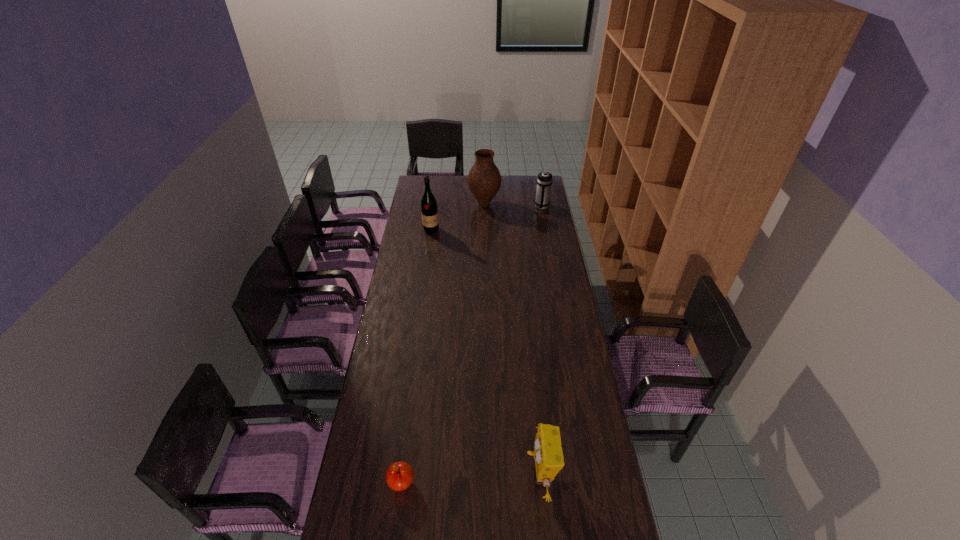
At what (x,y) coordinates should I click in order to perform the action: click on free spot between the sponge and the rightmost object. Please return your answer as a coordinate pair (x, y). This screenshot has height=540, width=960. Looking at the image, I should click on (540, 341).

The image size is (960, 540). I want to click on free space between the thermos bottle and the second object from right to left, so click(540, 341).

Identify the location of vacant area that lies between the third object from right to left and the apple. (443, 343).

Image resolution: width=960 pixels, height=540 pixels. I want to click on vacant area that lies between the shortest object and the sponge, so click(470, 479).

At what (x,y) coordinates should I click in order to perform the action: click on free spot between the thermos bottle and the third nearest object. Please return your answer as a coordinate pair (x, y). Looking at the image, I should click on (487, 218).

The width and height of the screenshot is (960, 540). Identify the location of free space between the shortest object and the vase. (443, 343).

Where is `vacant point located between the sponge and the apple`? The height and width of the screenshot is (540, 960). vacant point located between the sponge and the apple is located at coordinates (470, 479).

Find the location of a particular element. This screenshot has width=960, height=540. free area in between the fourth object from left to right and the vase is located at coordinates (512, 339).

Find the location of `vacant area that lies between the apple and the sponge`. vacant area that lies between the apple and the sponge is located at coordinates (470, 479).

You are a GUI agent. You are given a task and a screenshot of the screen. Output one action in this format:
    pyautogui.click(x=<x>, y=<y>)
    Task: Click on the object that stands as the third closest to the thermos bottle
    The height and width of the screenshot is (540, 960).
    Given the screenshot: What is the action you would take?
    pyautogui.click(x=548, y=454)